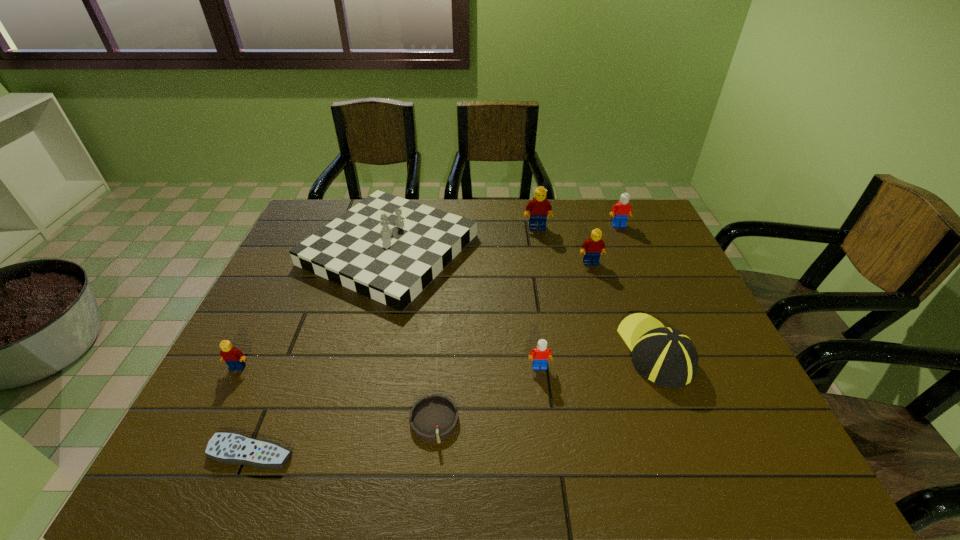
At what (x,y) coordinates should I click in order to perform the action: click on vacant area situated 0.360m with the brim of the baseball cap facing forward. Please return your answer as a coordinate pair (x, y). Looking at the image, I should click on click(x=612, y=237).

At what (x,y) coordinates should I click in order to perform the action: click on free space located with the brim of the baseball cap facing forward. Please return your answer as a coordinate pair (x, y). Image resolution: width=960 pixels, height=540 pixels. Looking at the image, I should click on (621, 260).

Where is `free space located on the front-facing side of the leftmost yellow Lego`? This screenshot has width=960, height=540. free space located on the front-facing side of the leftmost yellow Lego is located at coordinates (201, 440).

The image size is (960, 540). I want to click on free space located on the face of the left white Lego, so click(x=547, y=429).

Where is `blank space located 0.130m on the back of the eighth tallest object`? Image resolution: width=960 pixels, height=540 pixels. blank space located 0.130m on the back of the eighth tallest object is located at coordinates (441, 352).

Find the location of a particular element. Image resolution: width=960 pixels, height=540 pixels. vacant space located 0.250m on the right of the shortest object is located at coordinates (420, 453).

Identify the location of checkerboard at the far edge. (387, 248).

What are the coordinates of `ashtray positioned at the near edge` in the screenshot? It's located at coord(433,418).

Identify the location of remote control located at the near edge. (226, 447).

Identify the location of checkerboard that is at the left edge. This screenshot has width=960, height=540. (387, 248).